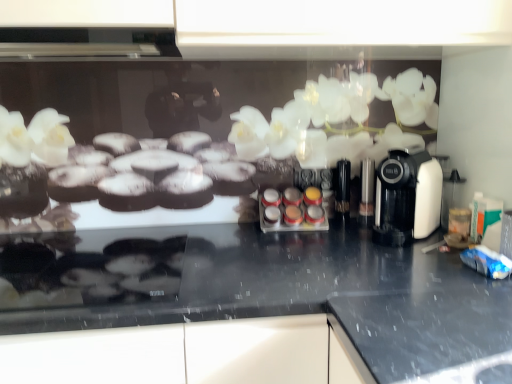
Question: From a real-world perspective, is black granite countertop at center positioned under translucent plastic spice rack at center based on gravity?

Choices:
 (A) no
 (B) yes

Answer: (B)

Question: Is black granite countertop at center to the right of translucent plastic spice rack at center from the viewer's perspective?

Choices:
 (A) no
 (B) yes

Answer: (A)

Question: Considering the relative sizes of black granite countertop at center and translucent plastic spice rack at center in the image provided, is black granite countertop at center shorter than translucent plastic spice rack at center?

Choices:
 (A) no
 (B) yes

Answer: (A)

Question: Is black granite countertop at center with translucent plastic spice rack at center?

Choices:
 (A) no
 (B) yes

Answer: (A)

Question: Would you say black granite countertop at center is outside translucent plastic spice rack at center?

Choices:
 (A) yes
 (B) no

Answer: (A)

Question: Looking at the image, does translucent plastic spice rack at center seem bigger or smaller compared to black granite countertop at center?

Choices:
 (A) big
 (B) small

Answer: (B)

Question: Considering their positions, is translucent plastic spice rack at center located in front of or behind black granite countertop at center?

Choices:
 (A) behind
 (B) front

Answer: (A)

Question: In terms of height, does translucent plastic spice rack at center look taller or shorter compared to black granite countertop at center?

Choices:
 (A) tall
 (B) short

Answer: (B)

Question: Would you say translucent plastic spice rack at center is to the left or to the right of black granite countertop at center in the picture?

Choices:
 (A) left
 (B) right

Answer: (B)

Question: Visually, is white plastic coffee machine at right positioned to the left or to the right of black granite countertop at center?

Choices:
 (A) right
 (B) left

Answer: (A)

Question: Based on their sizes in the image, would you say white plastic coffee machine at right is bigger or smaller than black granite countertop at center?

Choices:
 (A) small
 (B) big

Answer: (A)

Question: Is point (384, 190) closer or farther from the camera than point (252, 248)?

Choices:
 (A) closer
 (B) farther

Answer: (A)

Question: Is white plastic coffee machine at right wider or thinner than black granite countertop at center?

Choices:
 (A) wide
 (B) thin

Answer: (B)

Question: Is point (96, 281) closer or farther from the camera than point (282, 230)?

Choices:
 (A) farther
 (B) closer

Answer: (B)

Question: Visually, is black granite countertop at center positioned to the left or to the right of translucent plastic spice rack at center?

Choices:
 (A) left
 (B) right

Answer: (A)